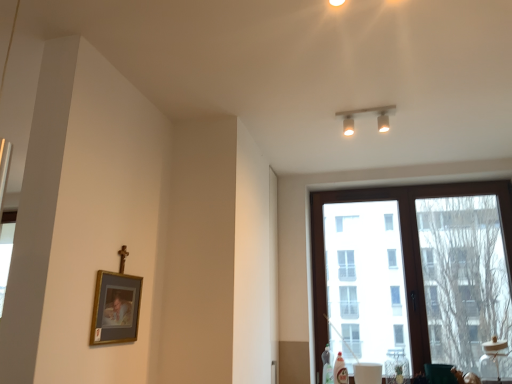
In order to face brown wooden window at right, should I rotate leftwards or rightwards?

It's best to rotate right around 20.640 degrees.

Where is `brown wooden window at right`? brown wooden window at right is located at coordinates (402, 246).

This screenshot has height=384, width=512. What do you see at coordinates (366, 112) in the screenshot?
I see `matte white track lights at upper center` at bounding box center [366, 112].

The width and height of the screenshot is (512, 384). I want to click on gold-framed picture at lower left, so click(x=115, y=308).

I want to click on brown wooden window at right, so pos(402,246).

Considering the relative sizes of brown wooden window at right and gold-framed picture at lower left in the image provided, is brown wooden window at right taller than gold-framed picture at lower left?

Yes, brown wooden window at right is taller than gold-framed picture at lower left.

Is brown wooden window at right not inside gold-framed picture at lower left?

Indeed, brown wooden window at right is completely outside gold-framed picture at lower left.

There is a gold-framed picture at lower left. At what (x,y) coordinates should I click in order to perform the action: click on window above it (from a real-world perspective). Please return your answer as a coordinate pair (x, y). Image resolution: width=512 pixels, height=384 pixels. Looking at the image, I should click on (402, 246).

Is brown wooden window at right in contact with gold-framed picture at lower left?

They are not placed beside each other.

Does gold-framed picture at lower left have a greater height compared to matte white track lights at upper center?

Yes.

From the image's perspective, is gold-framed picture at lower left above matte white track lights at upper center?

No, from the image's perspective, gold-framed picture at lower left is not above matte white track lights at upper center.

Is gold-framed picture at lower left smaller than matte white track lights at upper center?

Indeed, gold-framed picture at lower left has a smaller size compared to matte white track lights at upper center.

Is brown wooden window at right placed right next to matte white track lights at upper center?

brown wooden window at right and matte white track lights at upper center are clearly separated.

How many degrees apart are the facing directions of brown wooden window at right and matte white track lights at upper center?

brown wooden window at right and matte white track lights at upper center are facing 1.95 degrees away from each other.

In order to click on lamp on the left of brown wooden window at right in this screenshot , I will do `click(366, 112)`.

Is point (456, 192) farther from camera compared to point (346, 134)?

Yes, point (456, 192) is farther from viewer.

From a real-world perspective, is matte white track lights at upper center on top of gold-framed picture at lower left?

Yes, from a real-world perspective, matte white track lights at upper center is over gold-framed picture at lower left

Which is further, (360, 109) or (140, 290)?

The point (360, 109) is more distant.

Is matte white track lights at upper center smaller than gold-framed picture at lower left?

No, matte white track lights at upper center is not smaller than gold-framed picture at lower left.

Is gold-framed picture at lower left positioned far away from brown wooden window at right?

That's right, there is a large distance between gold-framed picture at lower left and brown wooden window at right.

Considering the relative positions of gold-framed picture at lower left and brown wooden window at right in the image provided, is gold-framed picture at lower left to the left of brown wooden window at right from the viewer's perspective?

Correct, you'll find gold-framed picture at lower left to the left of brown wooden window at right.

From the picture: In terms of height, does gold-framed picture at lower left look taller or shorter compared to brown wooden window at right?

In the image, gold-framed picture at lower left appears to be shorter than brown wooden window at right.

From the image's perspective, is gold-framed picture at lower left beneath brown wooden window at right?

Actually, gold-framed picture at lower left appears above brown wooden window at right in the image.

Considering the relative sizes of matte white track lights at upper center and brown wooden window at right in the image provided, is matte white track lights at upper center thinner than brown wooden window at right?

Yes.

From the image's perspective, is matte white track lights at upper center positioned above or below brown wooden window at right?

Based on their image positions, matte white track lights at upper center is located above brown wooden window at right.

I want to click on window behind the matte white track lights at upper center, so click(402, 246).

At what (x,y) coordinates should I click in order to perform the action: click on window on the right of the gold-framed picture at lower left. Please return your answer as a coordinate pair (x, y). The image size is (512, 384). Looking at the image, I should click on (402, 246).

Identify the location of picture frame beneath the matte white track lights at upper center (from a real-world perspective). This screenshot has width=512, height=384. (115, 308).

When comparing their distances from gold-framed picture at lower left, does matte white track lights at upper center or brown wooden window at right seem closer?

matte white track lights at upper center.

When comparing their distances from brown wooden window at right, does matte white track lights at upper center or gold-framed picture at lower left seem further?

gold-framed picture at lower left lies further to brown wooden window at right than the other object.

From the image, which object appears to be nearer to matte white track lights at upper center, gold-framed picture at lower left or brown wooden window at right?

The object closer to matte white track lights at upper center is brown wooden window at right.

Looking at the image, which one is located further to gold-framed picture at lower left, brown wooden window at right or matte white track lights at upper center?

brown wooden window at right.

Based on the photo, looking at the image, which one is located closer to brown wooden window at right, gold-framed picture at lower left or matte white track lights at upper center?

matte white track lights at upper center is positioned closer to the anchor brown wooden window at right.

Estimate the real-world distances between objects in this image. Which object is further from matte white track lights at upper center, brown wooden window at right or gold-framed picture at lower left?

gold-framed picture at lower left.

Find the location of a particular element. This screenshot has width=512, height=384. lamp between gold-framed picture at lower left and brown wooden window at right from left to right is located at coordinates (366, 112).